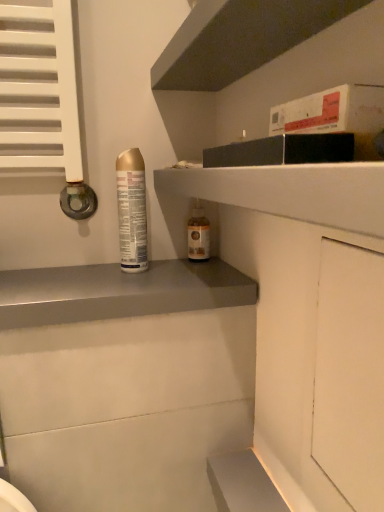
You are a GUI agent. You are given a task and a screenshot of the screen. Output one action in this format:
    pyautogui.click(x=<x>, y=<y>)
    Task: Click on the free spot to the right of gold metallic can at left, which ranks as the first bottle in front-to-back order
    Image resolution: width=384 pixels, height=512 pixels.
    Given the screenshot: What is the action you would take?
    pyautogui.click(x=193, y=273)